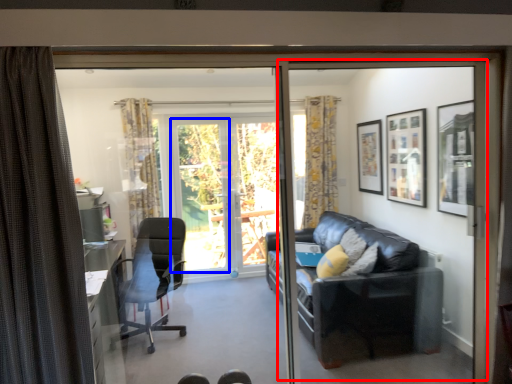
Question: Which object is further to the camera taking this photo, screen door (highlighted by a red box) or window screen (highlighted by a blue box)?

Choices:
 (A) screen door
 (B) window screen

Answer: (B)